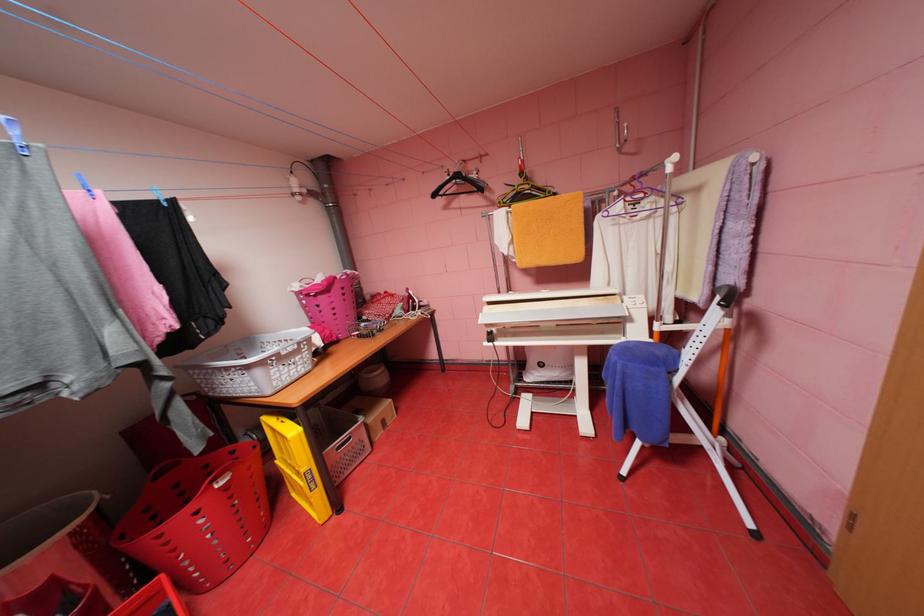
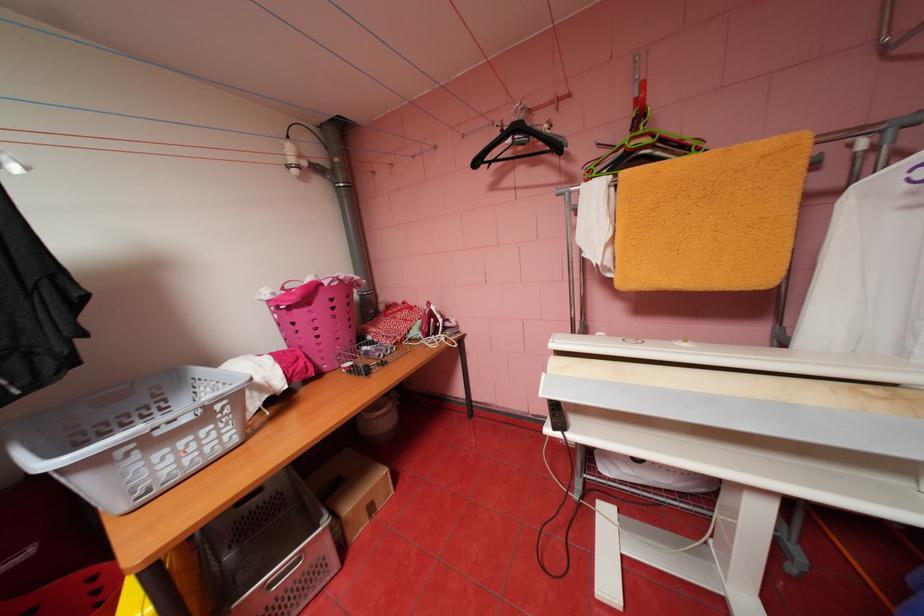
In the second image, find the point that corresponds to [496,342] in the first image.

(563, 429)